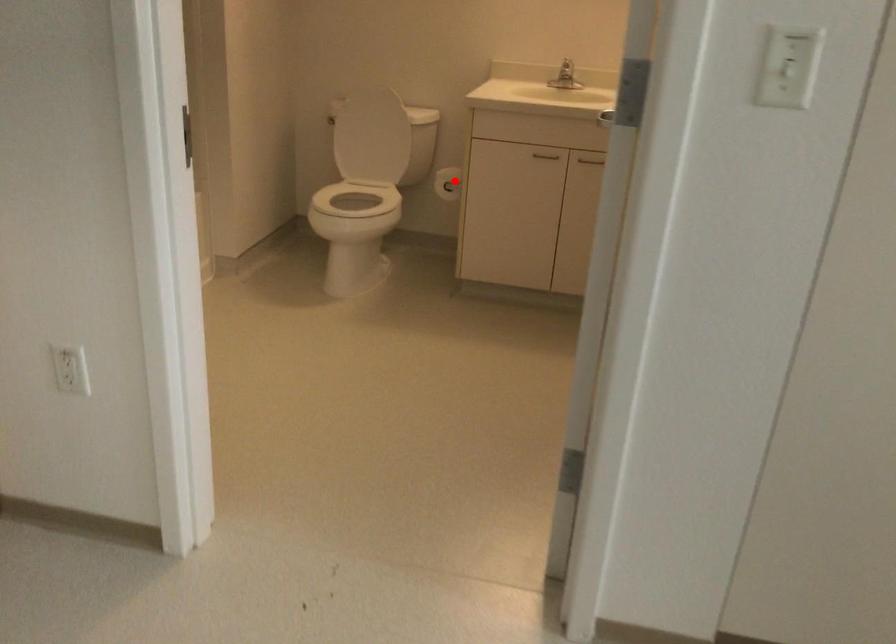
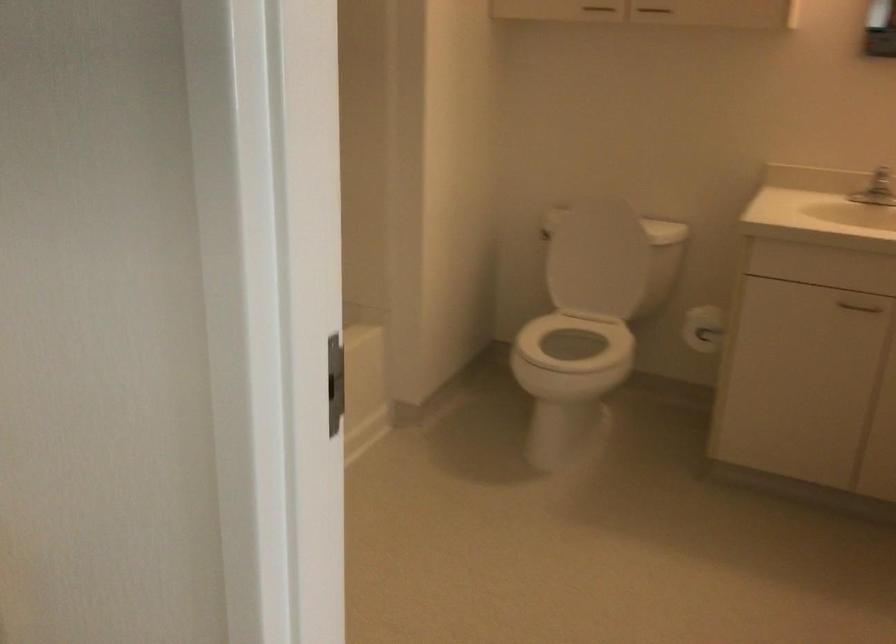
The point at the highlighted location is marked in the first image. Where is the corresponding point in the second image?

(702, 328)